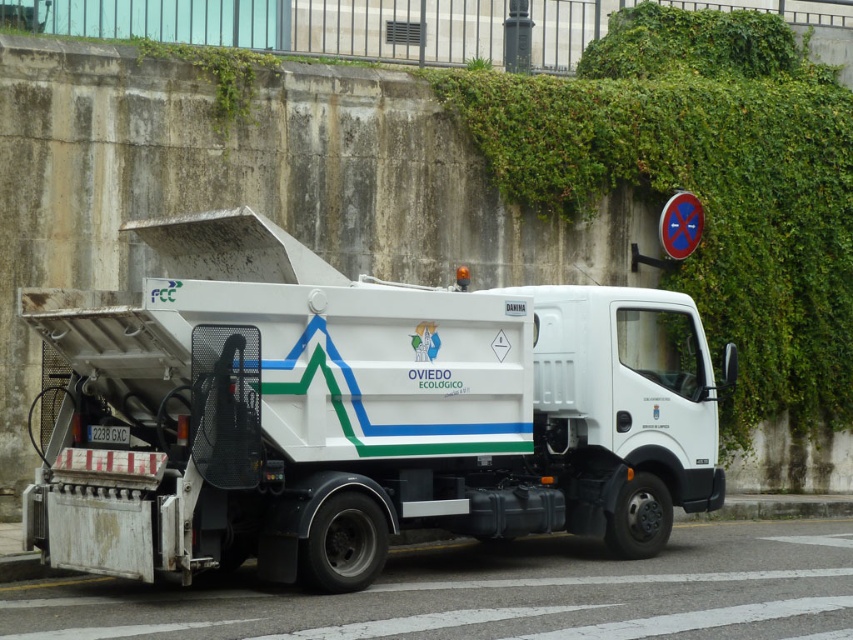
Which is above, white matte truck at center or metallic blue circle at upper right?

Positioned higher is metallic blue circle at upper right.

Between point (692, 362) and point (683, 216), which one is positioned behind?

The point (683, 216) is behind.

Locate an element on the screen. white matte truck at center is located at coordinates 357,412.

Between white matte truck at center and green leafy ivy at upper right, which one is positioned higher?

green leafy ivy at upper right

Can you confirm if white matte truck at center is positioned to the left of green leafy ivy at upper right?

Yes, white matte truck at center is to the left of green leafy ivy at upper right.

The image size is (853, 640). Find the location of `white matte truck at center`. white matte truck at center is located at coordinates (357, 412).

Is the position of green leafy ivy at upper right more distant than that of metallic blue circle at upper right?

That is True.

Between green leafy ivy at upper right and metallic blue circle at upper right, which one has less height?

metallic blue circle at upper right is shorter.

Describe the element at coordinates (706, 196) in the screenshot. I see `green leafy ivy at upper right` at that location.

Locate an element on the screen. green leafy ivy at upper right is located at coordinates (706, 196).